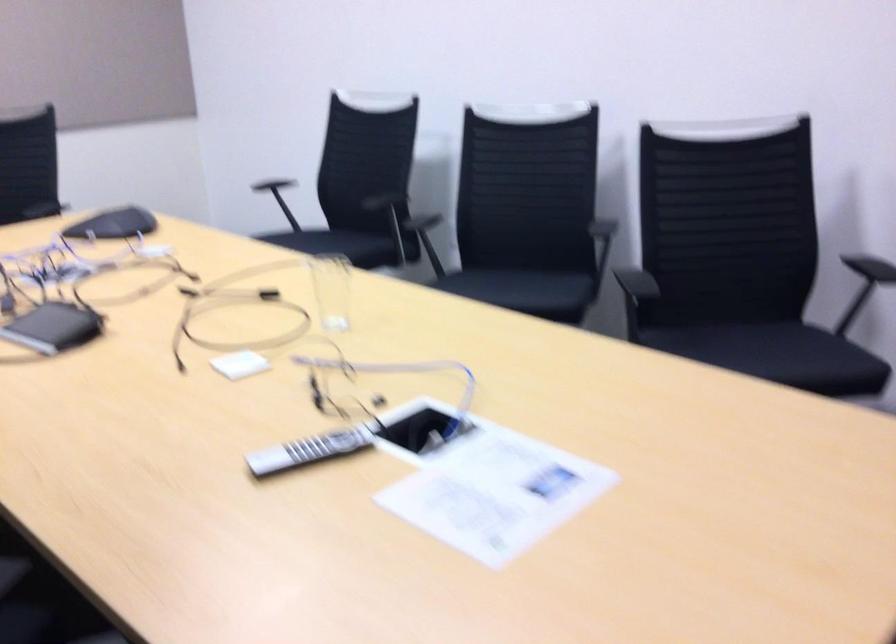
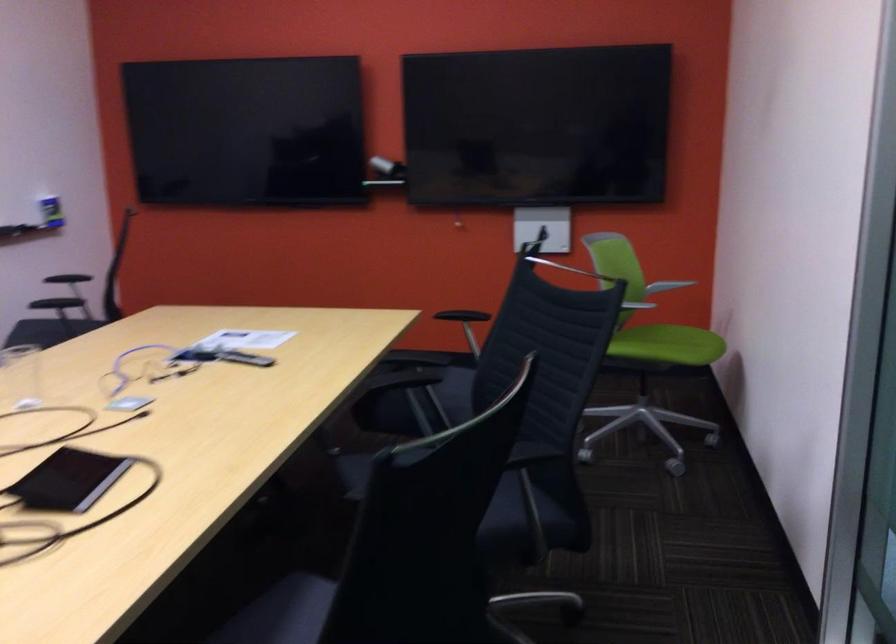
Where in the second image is the point corresponding to (x=328, y=444) from the first image?

(244, 357)